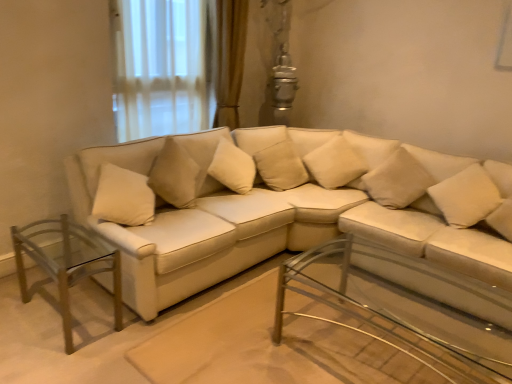
Question: Is point (386, 158) positioned closer to the camera than point (284, 172)?

Choices:
 (A) farther
 (B) closer

Answer: (B)

Question: From a real-world perspective, is beige fabric pillow at upper right, which is the 3th pillow from left to right, above or below beige fabric pillow at center, placed as the fourth pillow when sorted from right to left?

Choices:
 (A) below
 (B) above

Answer: (B)

Question: Which of these objects is positioned farthest from the beige fabric pillow at right, which is the 1th pillow from right to left?

Choices:
 (A) clear glass table at left, which is counted as the second table, starting from the right
 (B) beige fabric pillow at center, which is the third pillow in right-to-left order
 (C) matte white couch at center
 (D) beige fabric pillow at upper right, which is the 3th pillow from left to right
 (E) clear glass coffee table at center, which appears as the second table when viewed from the left

Answer: (A)

Question: Which is nearer to the matte white couch at center?

Choices:
 (A) clear glass table at left, which is counted as the second table, starting from the right
 (B) clear glass coffee table at center, the first table in the right-to-left sequence
 (C) beige fabric pillow at upper right, which ranks as the 2th pillow in right-to-left order
 (D) beige fabric pillow at center, which is the third pillow in right-to-left order
 (E) beige fabric pillow at center, placed as the fourth pillow when sorted from right to left

Answer: (B)